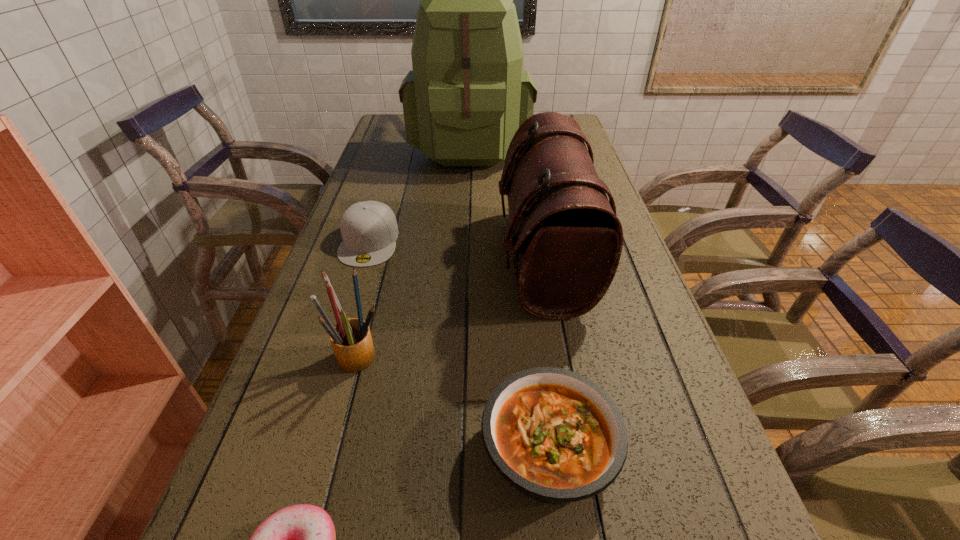
This screenshot has height=540, width=960. I want to click on free point between the tallest object and the fourth farthest object, so click(415, 249).

At what (x,y) coordinates should I click in order to perform the action: click on object that is the third closest to the fourth shortest object. Please return your answer as a coordinate pair (x, y). Looking at the image, I should click on (562, 229).

Find the location of a particular element. The image size is (960, 540). object that stands as the closest to the shortest object is located at coordinates (558, 437).

You are a GUI agent. You are given a task and a screenshot of the screen. Output one action in this format:
    pyautogui.click(x=<x>, y=<y>)
    Task: Click on the vacant space that satisfies the following two spatial constraints: 1. on the front-facing side of the cap; 2. on the right side of the fifth tallest object
    
    Given the screenshot: What is the action you would take?
    pyautogui.click(x=303, y=450)

Find the location of a particular element. free space that satisfies the following two spatial constraints: 1. on the front-facing side of the pencil box; 2. on the right side of the cap is located at coordinates (333, 355).

This screenshot has height=540, width=960. Find the location of `free location that satisfies the following two spatial constraints: 1. on the front-facing side of the fifth shortest object; 2. on the front side of the second shortest object`. free location that satisfies the following two spatial constraints: 1. on the front-facing side of the fifth shortest object; 2. on the front side of the second shortest object is located at coordinates (577, 450).

The image size is (960, 540). What are the coordinates of `free space that satisfies the following two spatial constraints: 1. on the front-facing side of the cap; 2. on the right side of the fourth farthest object` in the screenshot? It's located at (333, 355).